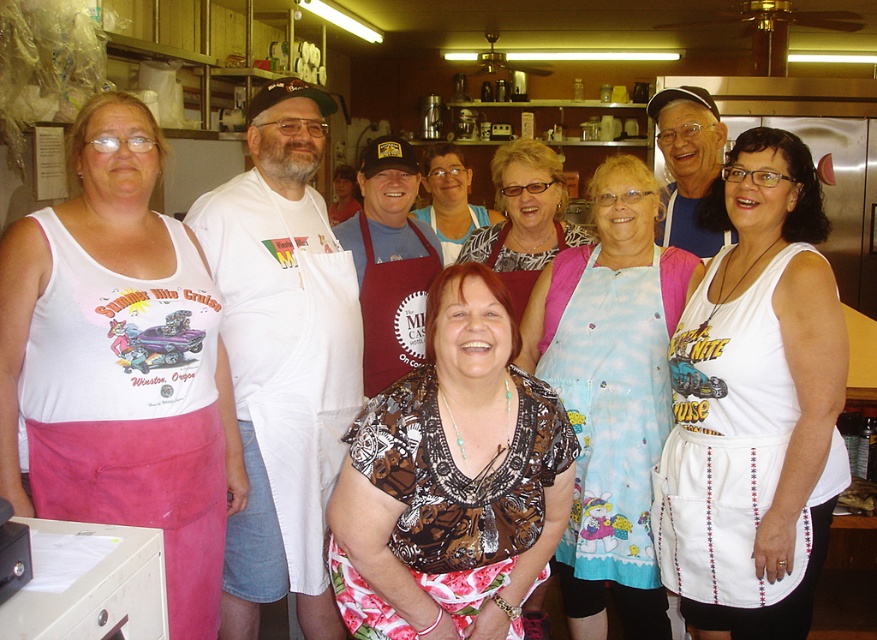
Question: Observing the image, what is the correct spatial positioning of white apron at center in reference to light blue fabric apron at center?

Choices:
 (A) below
 (B) above

Answer: (B)

Question: Which object is positioned farthest from the white fabric tank top at left?

Choices:
 (A) matte brown apron at center
 (B) maroon fabric apron at center
 (C) white fabric apron at center

Answer: (A)

Question: Which of the following is the closest to the observer?

Choices:
 (A) (419, 273)
 (B) (522, 376)

Answer: (B)

Question: In this image, where is brown printed blouse at center located relative to maroon fabric apron at center?

Choices:
 (A) left
 (B) right

Answer: (B)

Question: Is brown printed blouse at center to the left of light blue fabric apron at center from the viewer's perspective?

Choices:
 (A) yes
 (B) no

Answer: (A)

Question: Which object appears closest to the camera in this image?

Choices:
 (A) maroon fabric apron at center
 (B) white apron at center

Answer: (B)